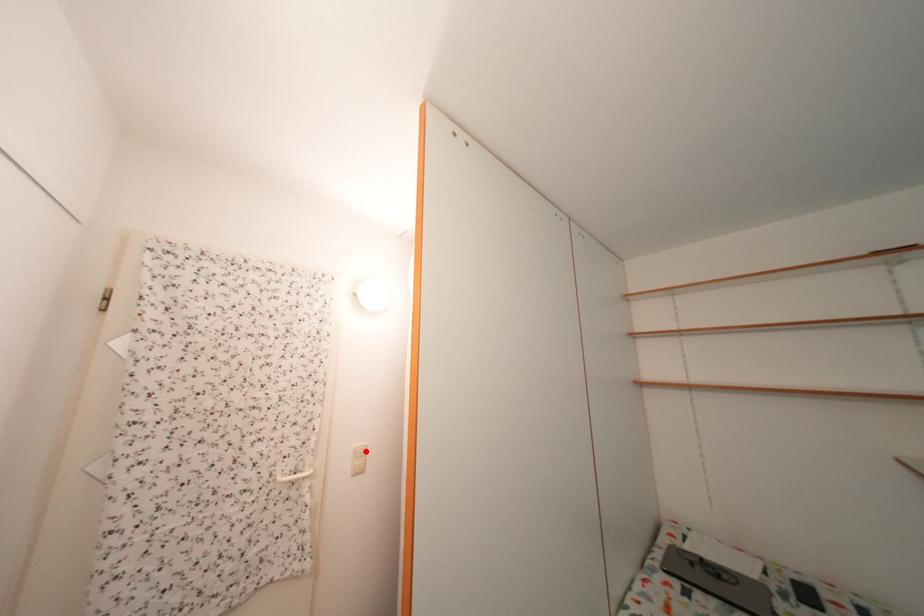
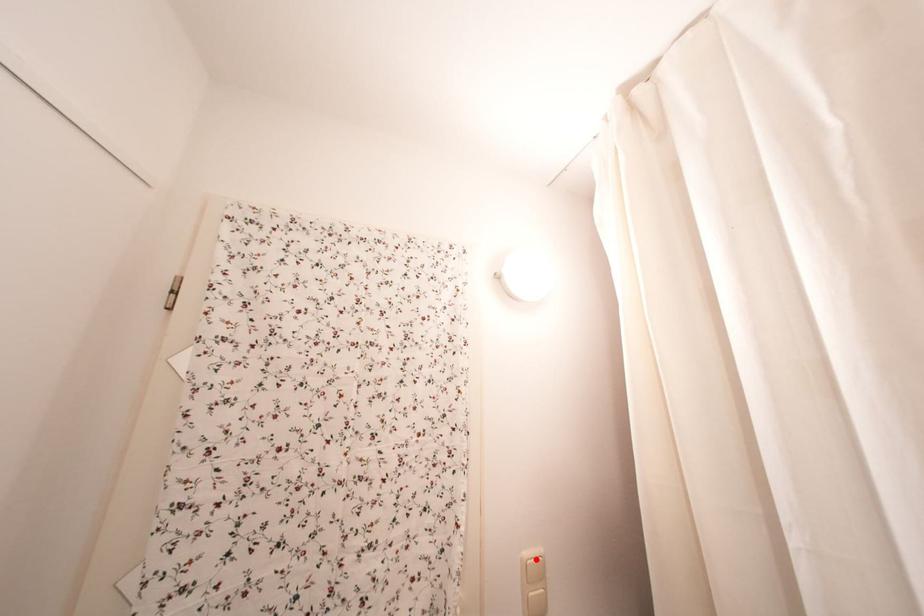
I am providing you with two images of the same scene from different viewpoints. A red point is marked on the first image and another point is marked on the second image. Are the points marked in image1 and image2 representing the same 3D position?

Yes